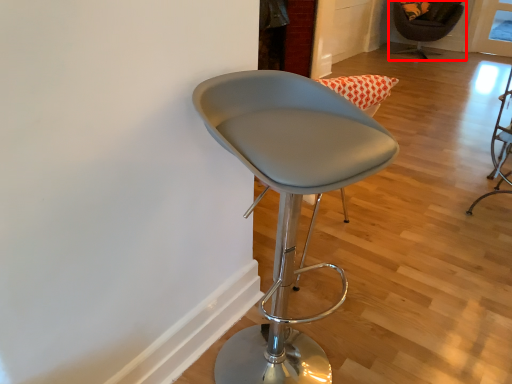
Question: From the image's perspective, where is chair (annotated by the red box) located in relation to chair in the image?

Choices:
 (A) above
 (B) below

Answer: (A)